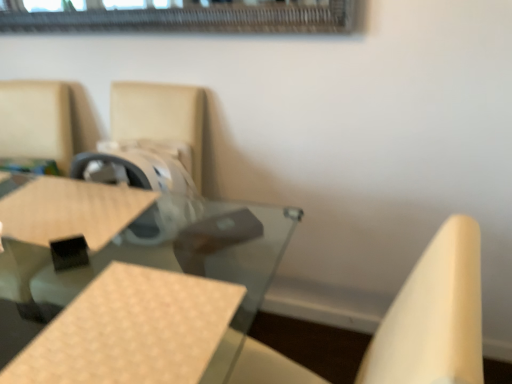
Question: Is beige woven plywood at center oriented away from matte brown chair at upper left?

Choices:
 (A) yes
 (B) no

Answer: (B)

Question: Considering the relative sizes of beige woven plywood at center and matte brown chair at upper left in the image provided, is beige woven plywood at center bigger than matte brown chair at upper left?

Choices:
 (A) no
 (B) yes

Answer: (A)

Question: Is beige woven plywood at center far from matte brown chair at upper left?

Choices:
 (A) yes
 (B) no

Answer: (B)

Question: From the image's perspective, would you say beige woven plywood at center is shown under matte brown chair at upper left?

Choices:
 (A) yes
 (B) no

Answer: (A)

Question: Is beige woven plywood at center thinner than matte brown chair at upper left?

Choices:
 (A) no
 (B) yes

Answer: (B)

Question: Considering the relative sizes of beige woven plywood at center and matte brown chair at upper left in the image provided, is beige woven plywood at center shorter than matte brown chair at upper left?

Choices:
 (A) no
 (B) yes

Answer: (B)

Question: From the image's perspective, is matte brown chair at upper left on top of clear glass table at center?

Choices:
 (A) yes
 (B) no

Answer: (A)

Question: From the image's perspective, is matte brown chair at upper left beneath clear glass table at center?

Choices:
 (A) no
 (B) yes

Answer: (A)

Question: Does matte brown chair at upper left have a lesser height compared to clear glass table at center?

Choices:
 (A) no
 (B) yes

Answer: (B)

Question: Considering the relative positions of matte brown chair at upper left and clear glass table at center in the image provided, is matte brown chair at upper left to the left of clear glass table at center from the viewer's perspective?

Choices:
 (A) no
 (B) yes

Answer: (B)

Question: Would you say matte brown chair at upper left is outside clear glass table at center?

Choices:
 (A) yes
 (B) no

Answer: (A)

Question: Is matte brown chair at upper left further to the viewer compared to clear glass table at center?

Choices:
 (A) no
 (B) yes

Answer: (B)

Question: Can you confirm if beige woven plywood at center is thinner than clear glass table at center?

Choices:
 (A) no
 (B) yes

Answer: (B)